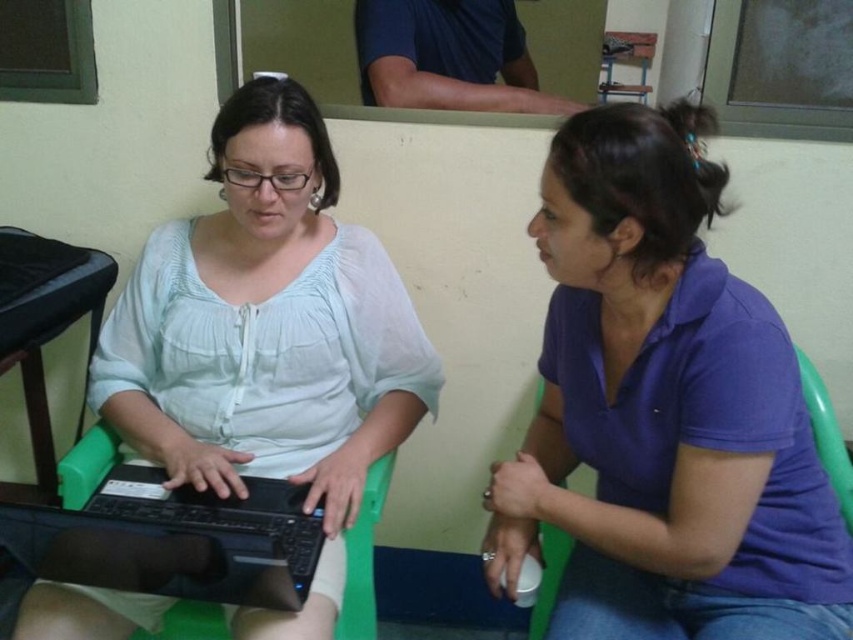
Question: Can you confirm if matte white shirt at center is positioned below black matte laptop at center?

Choices:
 (A) no
 (B) yes

Answer: (A)

Question: Is matte white shirt at center closer to the viewer compared to green plastic chair at lower left?

Choices:
 (A) no
 (B) yes

Answer: (B)

Question: From the image, what is the correct spatial relationship of purple cotton shirt at center in relation to matte white shirt at center?

Choices:
 (A) left
 (B) right

Answer: (B)

Question: Which object appears closest to the camera in this image?

Choices:
 (A) black matte laptop at center
 (B) matte white shirt at center

Answer: (A)

Question: Which object is positioned farthest from the matte white shirt at center?

Choices:
 (A) black matte laptop at center
 (B) green plastic chair at lower left
 (C) purple cotton shirt at center
 (D) green plastic chair at lower right

Answer: (D)

Question: Among these points, which one is nearest to the camera?

Choices:
 (A) (160, 513)
 (B) (627, 115)
 (C) (100, 440)

Answer: (B)